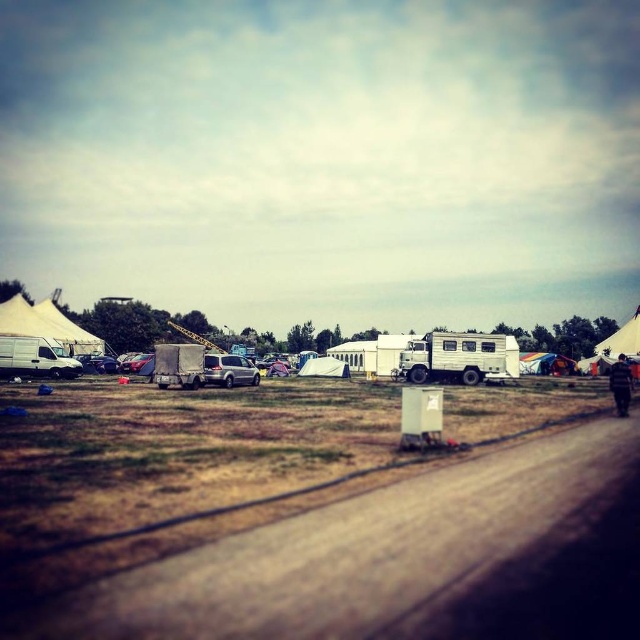
Question: Is matte white van at left thinner than white canvas tent at right?

Choices:
 (A) no
 (B) yes

Answer: (B)

Question: Does white canvas tent at left have a lesser width compared to rainbow fabric tent at center?

Choices:
 (A) no
 (B) yes

Answer: (B)

Question: Does brown dirt track at center appear on the left side of white canvas tent at center?

Choices:
 (A) yes
 (B) no

Answer: (B)

Question: Among these points, which one is farthest from the camera?

Choices:
 (A) (616, 387)
 (B) (529, 582)

Answer: (A)

Question: Which point is farther from the camera taking this photo?

Choices:
 (A) (621, 372)
 (B) (600, 353)
 (C) (8, 301)
 (D) (353, 538)

Answer: (B)

Question: Which of these objects is positioned farthest from the white canvas tent at center?

Choices:
 (A) white matte recreational vehicle at center
 (B) brown dirt track at center

Answer: (B)